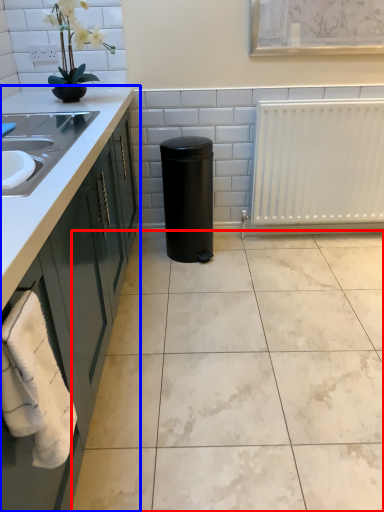
Question: Which object appears farthest to the camera in this image, ceramic tile (highlighted by a red box) or countertop (highlighted by a blue box)?

Choices:
 (A) ceramic tile
 (B) countertop

Answer: (A)